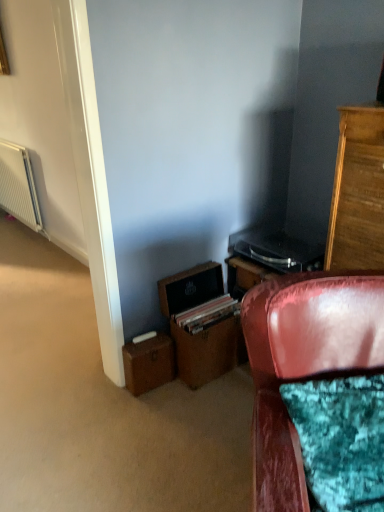
I want to click on empty space that is to the right of brown cardboard box at lower left, so click(183, 395).